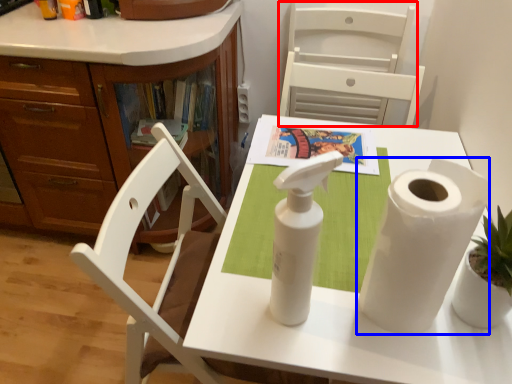
Question: Which object appears farthest to the camera in this image, armchair (highlighted by a red box) or paper towel (highlighted by a blue box)?

Choices:
 (A) armchair
 (B) paper towel

Answer: (A)